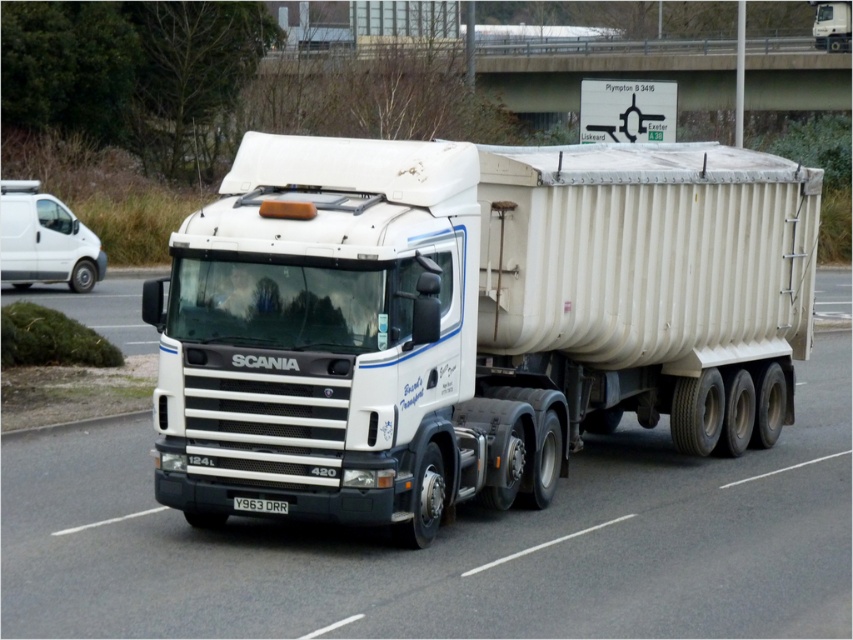
Question: Among these objects, which one is farthest from the camera?

Choices:
 (A) white matte truck at center
 (B) black plastic license plate at center

Answer: (A)

Question: Can you confirm if white matte truck at center is positioned to the right of black plastic license plate at center?

Choices:
 (A) no
 (B) yes

Answer: (A)

Question: Which point appears farthest from the camera in this image?

Choices:
 (A) (271, 474)
 (B) (263, 499)

Answer: (B)

Question: Is white matte truck at center positioned behind black plastic license plate at center?

Choices:
 (A) no
 (B) yes

Answer: (B)

Question: Which of the following is the closest to the observer?

Choices:
 (A) white matte truck at center
 (B) black plastic license plate at center

Answer: (B)

Question: Does white matte truck at center have a greater width compared to black plastic license plate at center?

Choices:
 (A) yes
 (B) no

Answer: (B)